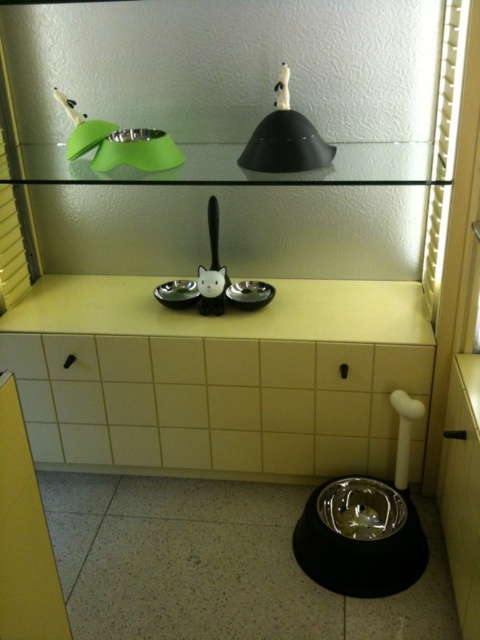
You are setting up a small decorative item that requires 20 inches of space between its placement points. You have the yellow matte counter top at center and the black matte lampshade at upper center in view. Can you place the item between these two points without exceeding the space requirement?

The yellow matte counter top at center and the black matte lampshade at upper center are 18.89 inches apart from each other. Since the required space is 20 inches, the distance is insufficient, so you cannot place the item between them without exceeding the space requirement.

You are a robotic arm trying to place a new pet bowl on the yellow matte counter top at center. The robotic arm can only move in straight lines. There is an obstacle at point (227, 314). Where should you place the new bowl to avoid the obstacle?

Place the new bowl away from point (227, 314) on the yellow matte counter top at center to avoid the obstacle.

You are a robotic arm positioned 1.5 meters away from the yellow matte counter top at center. Can you reach the counter top to place a pet bowl?

The distance between you and the yellow matte counter top at center is 1.39 meters, which is less than your 1.5 meters reach. Therefore, you can reach the counter top to place a pet bowl.